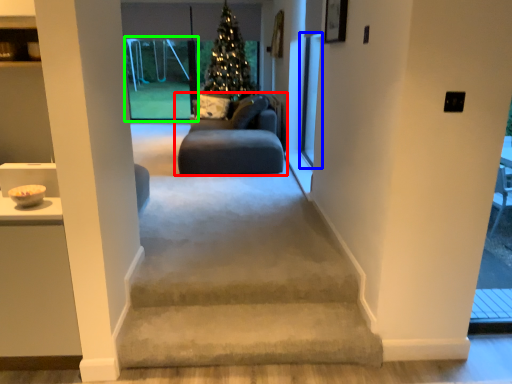
Question: Which is nearer to the studio couch (highlighted by a red box)? screen door (highlighted by a blue box) or window (highlighted by a green box).

Choices:
 (A) screen door
 (B) window

Answer: (A)